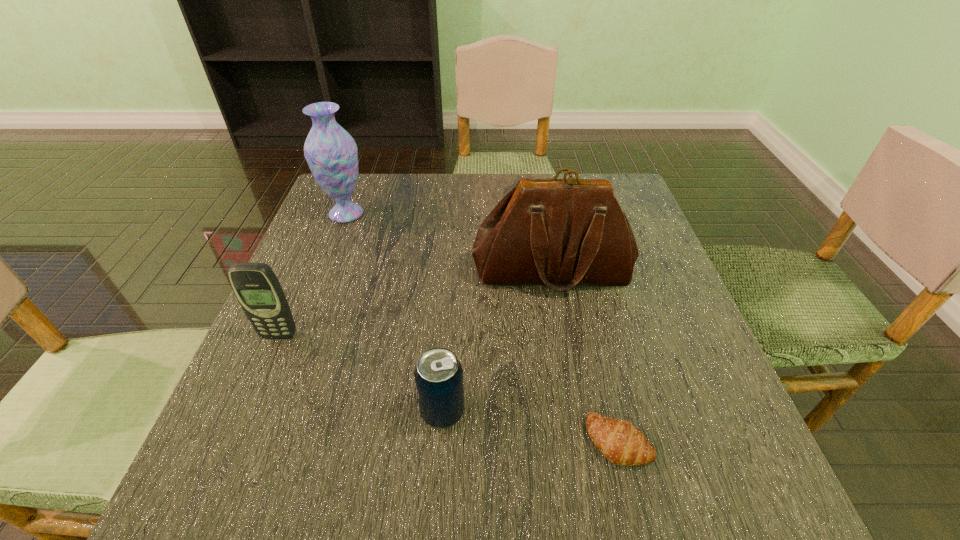
Where is `vacant space that's between the third shortest object and the soda can`? The image size is (960, 540). vacant space that's between the third shortest object and the soda can is located at coordinates (x=361, y=374).

This screenshot has height=540, width=960. What are the coordinates of `free space between the vase and the shortest object` in the screenshot? It's located at (483, 327).

This screenshot has width=960, height=540. In order to click on vacant area between the shortest object and the farthest object in this screenshot , I will do `click(483, 327)`.

Where is `object that is the third closest to the crescent roll`? The height and width of the screenshot is (540, 960). object that is the third closest to the crescent roll is located at coordinates (256, 287).

Find the location of a particular element. The height and width of the screenshot is (540, 960). the fourth closest object to the shoulder bag is located at coordinates (256, 287).

The height and width of the screenshot is (540, 960). Find the location of `vacant space that satisfies the following two spatial constraints: 1. on the screen of the cellular telephone; 2. on the right side of the soda can`. vacant space that satisfies the following two spatial constraints: 1. on the screen of the cellular telephone; 2. on the right side of the soda can is located at coordinates (247, 411).

Image resolution: width=960 pixels, height=540 pixels. In order to click on vacant region that satisfies the following two spatial constraints: 1. on the screen of the crescent roll; 2. on the right side of the cellular telephone in this screenshot , I will do `click(234, 441)`.